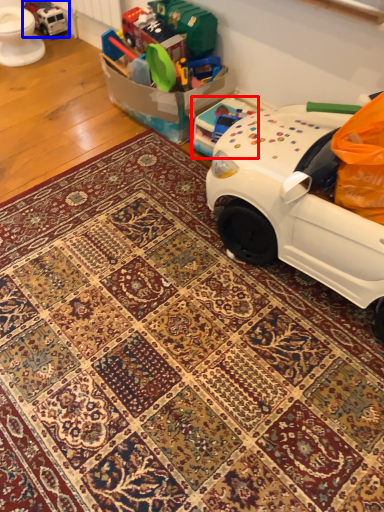
Question: Which object appears closest to the camera in this image, toy (highlighted by a red box) or toy (highlighted by a blue box)?

Choices:
 (A) toy
 (B) toy

Answer: (A)